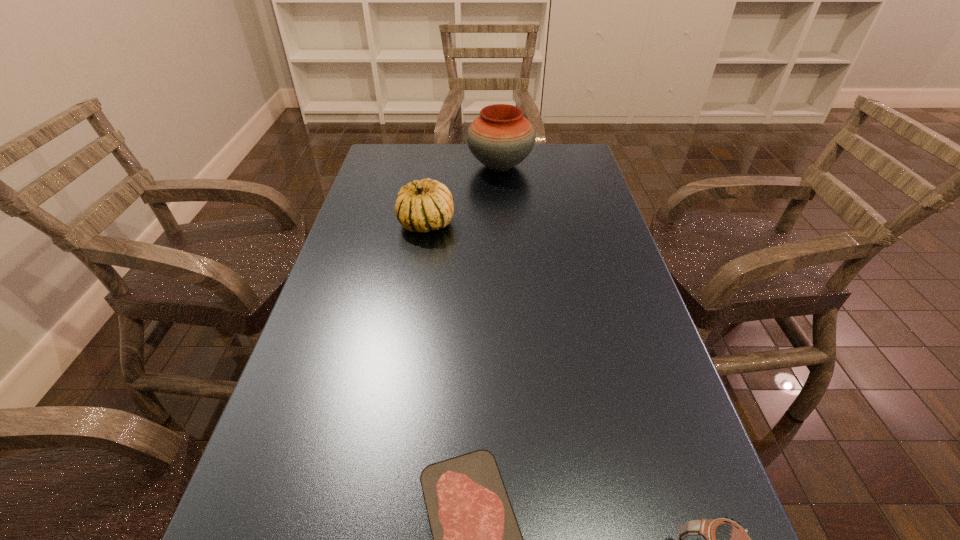
Where is `vacant space at the right edge`? vacant space at the right edge is located at coordinates (581, 192).

The width and height of the screenshot is (960, 540). What are the coordinates of `free space at the far left corner of the desktop` in the screenshot? It's located at (409, 178).

In the image, there is a desktop. Identify the location of vacant space at the far right corner. (543, 169).

Where is `free space between the farthest object and the third shortest object`? free space between the farthest object and the third shortest object is located at coordinates (463, 195).

At what (x,y) coordinates should I click in order to perform the action: click on free spot between the gourd and the farthest object. Please return your answer as a coordinate pair (x, y). The width and height of the screenshot is (960, 540). Looking at the image, I should click on (463, 195).

Find the location of a particular element. The height and width of the screenshot is (540, 960). object that is the second closest one to the second farthest object is located at coordinates (476, 537).

The image size is (960, 540). Find the location of `object that stands as the second closest to the watch`. object that stands as the second closest to the watch is located at coordinates (421, 206).